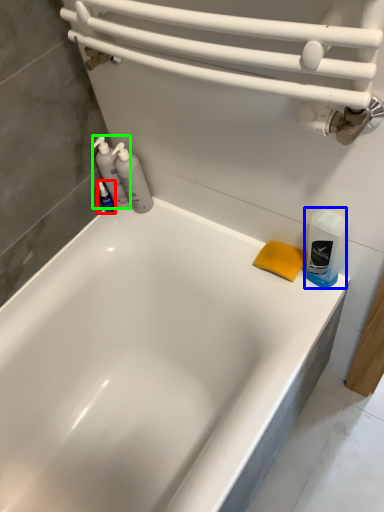
Question: Based on their relative distances, which object is farther from toiletry (highlighted by a red box)? Choose from cleaning product (highlighted by a blue box) and cleaning product (highlighted by a green box).

Choices:
 (A) cleaning product
 (B) cleaning product

Answer: (A)